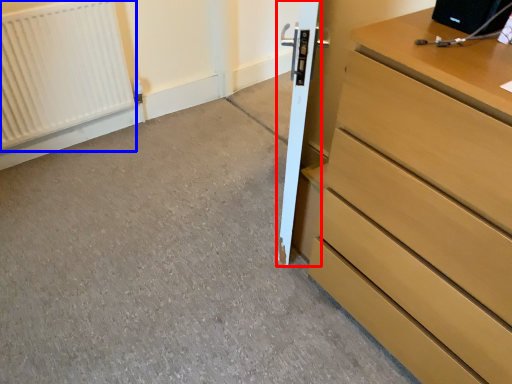
Question: Among these objects, which one is farthest to the camera, door (highlighted by a red box) or radiator (highlighted by a blue box)?

Choices:
 (A) door
 (B) radiator

Answer: (B)